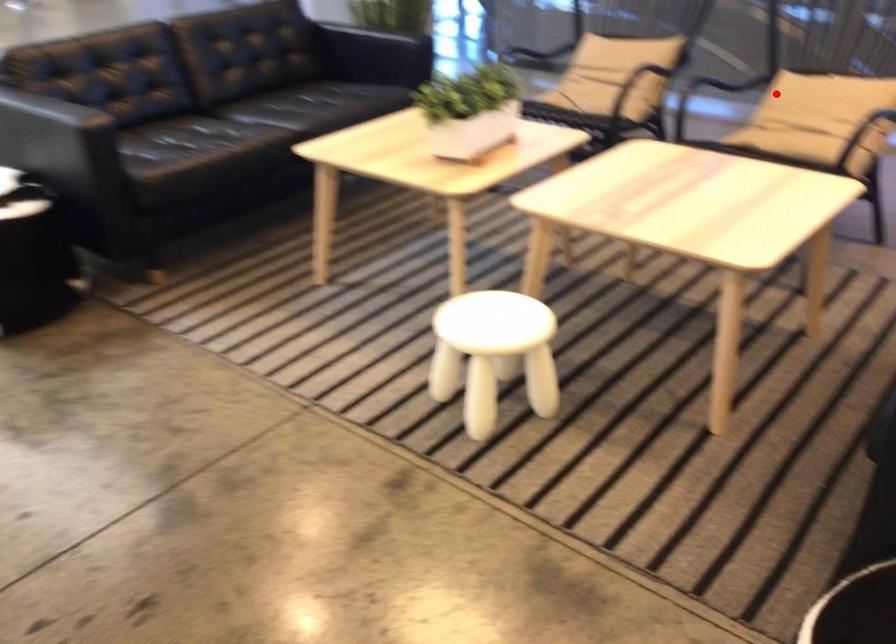
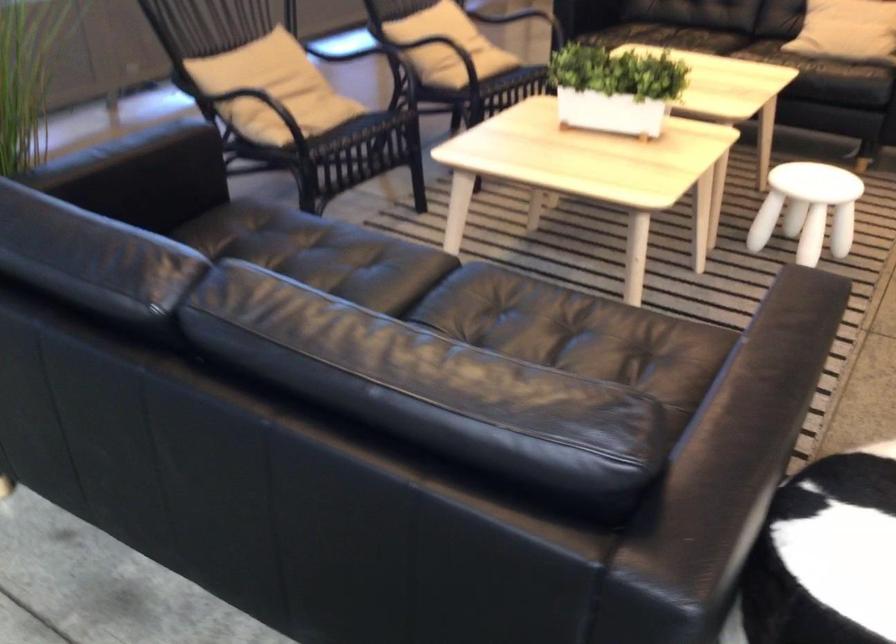
Question: I am providing you with two images of the same scene from different viewpoints. In image1, a red point is highlighted. Considering the same 3D point in image2, which of the following is correct?

Choices:
 (A) It is closer
 (B) It is farther

Answer: (B)